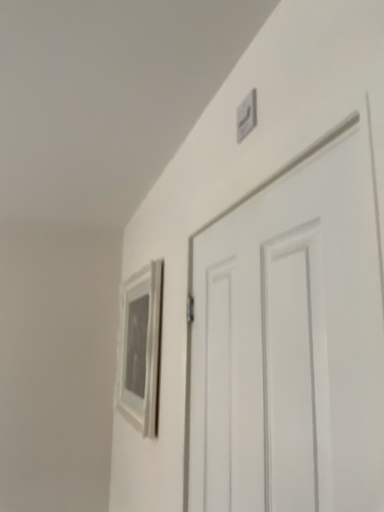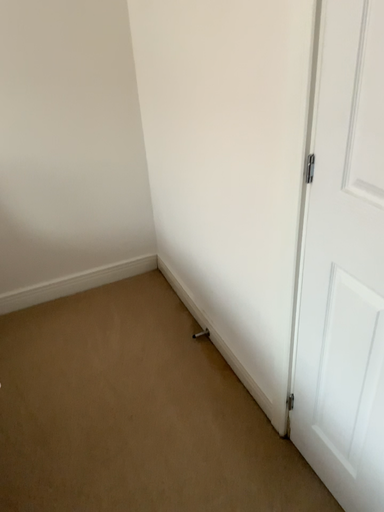
Question: Which way did the camera rotate in the video?

Choices:
 (A) rotated downward
 (B) rotated upward

Answer: (A)